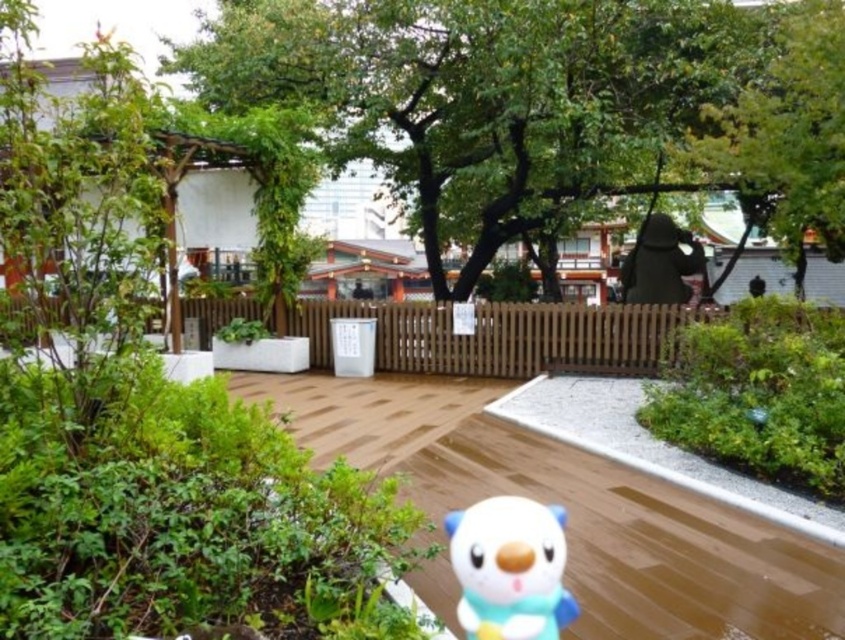
Question: Does green leafy tree at center appear over white matte plush toy at lower center?

Choices:
 (A) yes
 (B) no

Answer: (A)

Question: Is green leafy tree at center bigger than white matte plush toy at lower center?

Choices:
 (A) no
 (B) yes

Answer: (B)

Question: From the image, what is the correct spatial relationship of green leafy tree at center in relation to white matte plush toy at lower center?

Choices:
 (A) above
 (B) below

Answer: (A)

Question: Which point is farther to the camera?

Choices:
 (A) (826, 134)
 (B) (559, 557)

Answer: (A)

Question: Among these points, which one is nearest to the camera?

Choices:
 (A) (475, 584)
 (B) (304, 8)

Answer: (A)